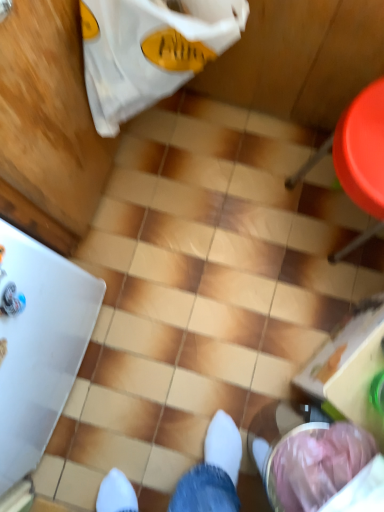
Question: From the image's perspective, is red plastic chair at right positioned above or below white fabric grocery bag at upper left?

Choices:
 (A) above
 (B) below

Answer: (B)

Question: From a real-world perspective, relative to white fabric grocery bag at upper left, is red plastic chair at right vertically above or below?

Choices:
 (A) above
 (B) below

Answer: (B)

Question: Is red plastic chair at right inside the boundaries of white fabric grocery bag at upper left, or outside?

Choices:
 (A) inside
 (B) outside

Answer: (B)

Question: Do you think white fabric grocery bag at upper left is within red plastic chair at right, or outside of it?

Choices:
 (A) inside
 (B) outside

Answer: (B)

Question: Considering the positions of white fabric grocery bag at upper left and red plastic chair at right in the image, is white fabric grocery bag at upper left bigger or smaller than red plastic chair at right?

Choices:
 (A) small
 (B) big

Answer: (A)

Question: Considering the relative positions of white fabric grocery bag at upper left and red plastic chair at right in the image provided, is white fabric grocery bag at upper left to the left or to the right of red plastic chair at right?

Choices:
 (A) left
 (B) right

Answer: (A)

Question: Is white fabric grocery bag at upper left wider or thinner than red plastic chair at right?

Choices:
 (A) wide
 (B) thin

Answer: (B)